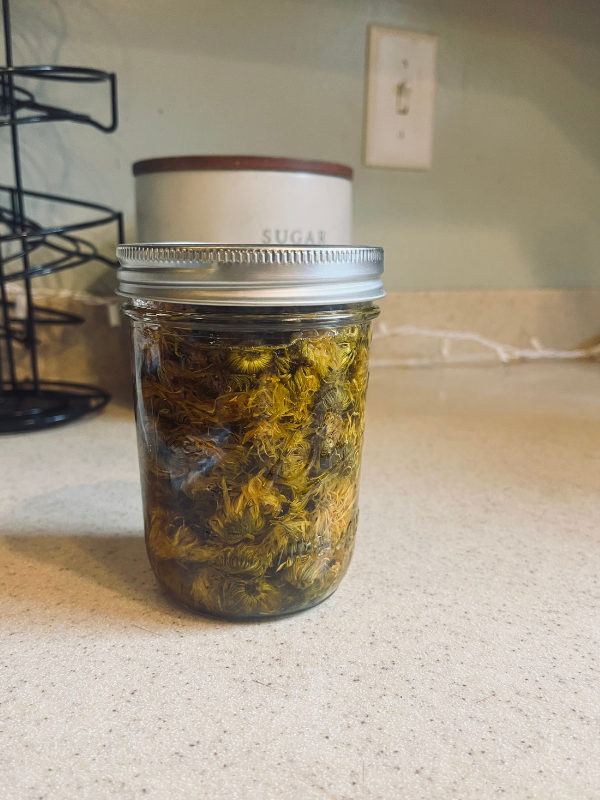
Where is `containers`? The height and width of the screenshot is (800, 600). containers is located at coordinates (242, 414), (241, 198).